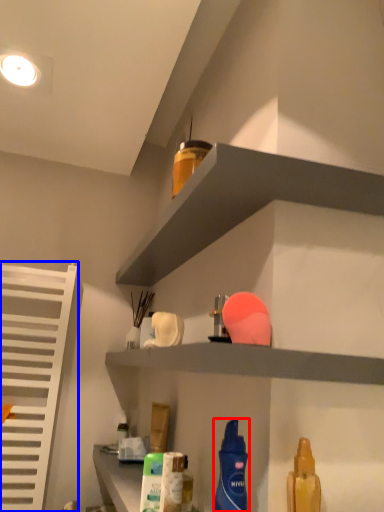
Question: Which of the following is the farthest to the observer, cleaning product (highlighted by a red box) or shutter (highlighted by a blue box)?

Choices:
 (A) cleaning product
 (B) shutter

Answer: (B)